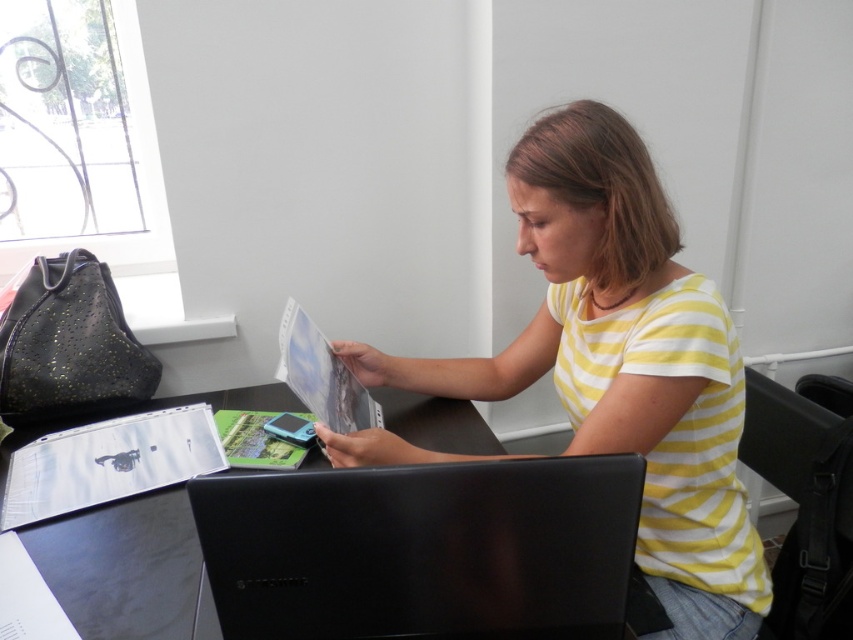
You are standing in the office and want to place a small item at the point with coordinates (355, 554). Is this point on the desk?

Yes, the point (355, 554) is on the black plastic table at center, so it is on the desk.

You are organizing a workspace and need to place a new item on the desk. Given that the black plastic table at center is larger than the black plastic laptop at center, can you fit a small notebook between them?

The black plastic table at center is bigger than the black plastic laptop at center, so there might be enough space between them to fit a small notebook.

You are a delivery person who needs to place a package on the desk. The package is 10 cm in length. The desk has a maximum load capacity of 5 kg. Can you safely place the package on the black plastic table at center?

The black plastic table at center is located at point [355,554]. Since the package weighs less than 5 kg, it can be safely placed there.